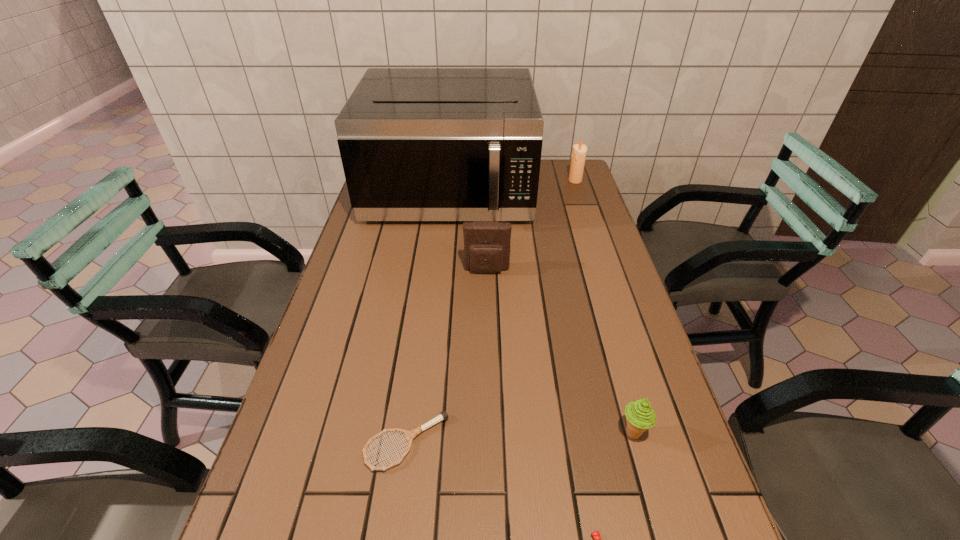
The image size is (960, 540). What are the coordinates of `vacant region at the far right corner of the desktop` in the screenshot? It's located at (568, 162).

Where is `empty space that is in between the second shortest object and the candle`? This screenshot has height=540, width=960. empty space that is in between the second shortest object and the candle is located at coordinates (491, 312).

Locate an element on the screen. This screenshot has width=960, height=540. unoccupied position between the left tennis racket and the candle is located at coordinates (491, 312).

Image resolution: width=960 pixels, height=540 pixels. Find the location of `free space between the candle and the icecream`. free space between the candle and the icecream is located at coordinates (604, 307).

Where is `free area in between the third farthest object and the taller tennis racket`? free area in between the third farthest object and the taller tennis racket is located at coordinates (446, 356).

At what (x,y) coordinates should I click in order to perform the action: click on free space between the taller tennis racket and the icecream. Please return your answer as a coordinate pair (x, y). Looking at the image, I should click on (519, 438).

The image size is (960, 540). What are the coordinates of `empty space between the icecream and the taller tennis racket` in the screenshot? It's located at (519, 438).

Identify the location of vacant area that lies between the farther tennis racket and the icecream. (519, 438).

Point out which object is positioned as the second nearest to the candle. Please provide its 2D coordinates. Your answer should be formatted as a tuple, i.e. [(x, y)], where the tuple contains the x and y coordinates of a point satisfying the conditions above.

[(486, 243)]

Identify which object is the third closest to the left tennis racket. Please provide its 2D coordinates. Your answer should be formatted as a tuple, i.e. [(x, y)], where the tuple contains the x and y coordinates of a point satisfying the conditions above.

[(486, 243)]